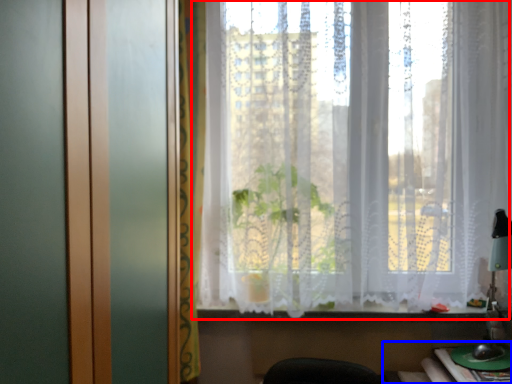
Question: Which of the following is the closest to the observer, curtain (highlighted by a red box) or table (highlighted by a blue box)?

Choices:
 (A) curtain
 (B) table

Answer: (B)